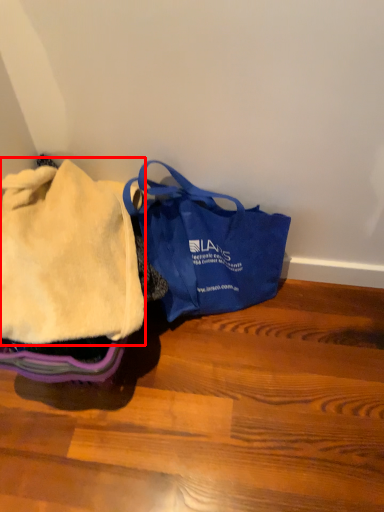
Question: From the image's perspective, where is cloth (annotated by the red box) located relative to handbag?

Choices:
 (A) below
 (B) above

Answer: (B)